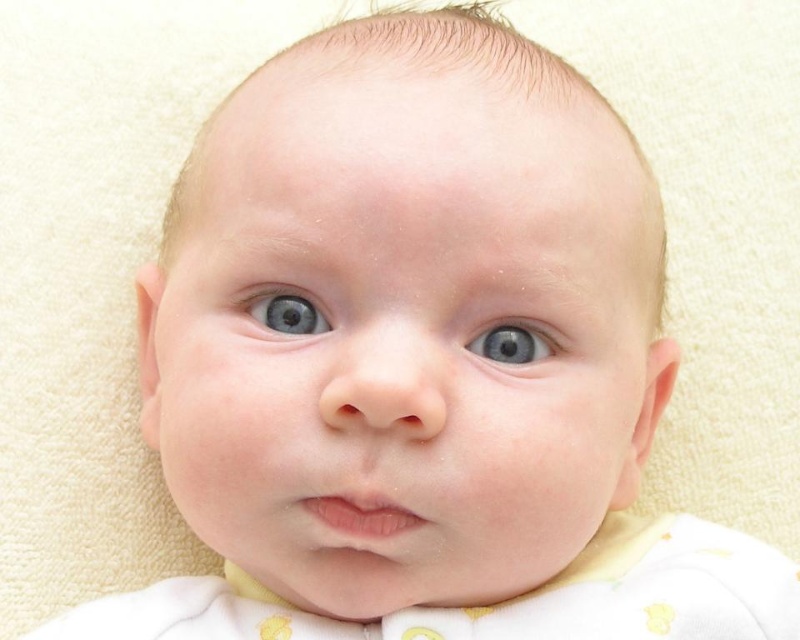
Question: Can you confirm if blue smooth eye at center is thinner than blue glossy eye at center?

Choices:
 (A) no
 (B) yes

Answer: (A)

Question: Is blue smooth eye at center to the left of blue glossy eye at center from the viewer's perspective?

Choices:
 (A) no
 (B) yes

Answer: (A)

Question: Among these objects, which one is nearest to the camera?

Choices:
 (A) blue glossy eye at center
 (B) blue smooth eye at center

Answer: (B)

Question: Is blue smooth eye at center in front of blue glossy eye at center?

Choices:
 (A) no
 (B) yes

Answer: (B)

Question: Which object is closer to the camera taking this photo?

Choices:
 (A) blue glossy eye at center
 (B) blue smooth eye at center

Answer: (B)